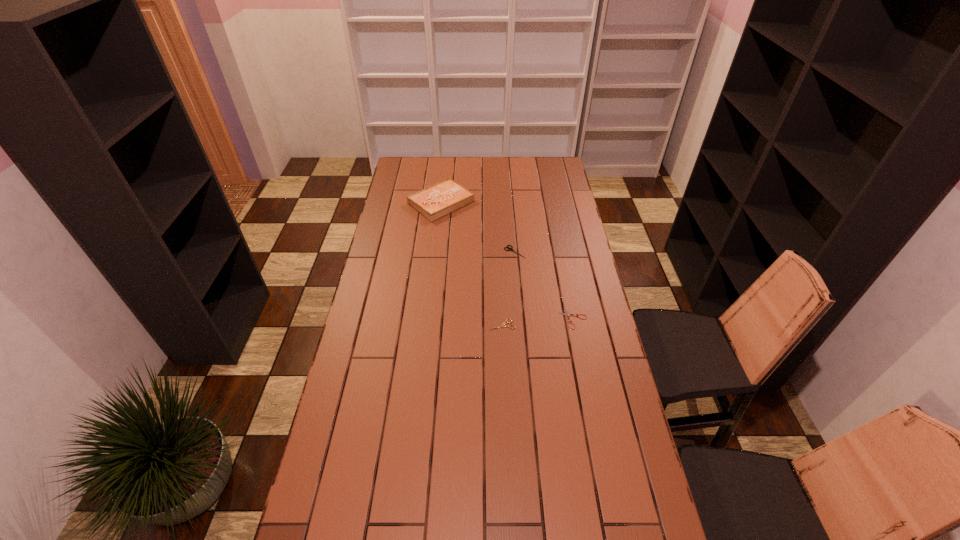
Find the location of `empty space that is in between the second shortest shears and the rightmost shears`. empty space that is in between the second shortest shears and the rightmost shears is located at coordinates (538, 321).

The image size is (960, 540). Find the location of `empty location between the second tallest shears and the tallest object`. empty location between the second tallest shears and the tallest object is located at coordinates (471, 264).

You are a GUI agent. You are given a task and a screenshot of the screen. Output one action in this format:
    pyautogui.click(x=<x>, y=<y>)
    Task: Click on the vacant space that is in between the leftmost object and the second shortest object
    This screenshot has height=540, width=960.
    Given the screenshot: What is the action you would take?
    pyautogui.click(x=471, y=264)

Where is `vacant space that's between the third tallest object and the farthest shears`? The image size is (960, 540). vacant space that's between the third tallest object and the farthest shears is located at coordinates (509, 288).

This screenshot has height=540, width=960. Identify the location of vacant space that is in between the farthest shears and the rightmost shears. (544, 285).

This screenshot has width=960, height=540. What are the coordinates of `vacant space that's between the rightmost object and the second shortest object` in the screenshot? It's located at (538, 321).

Find the location of a particular element. Image resolution: width=960 pixels, height=540 pixels. vacant space that's between the shortest shears and the third tallest object is located at coordinates (538, 321).

At what (x,y) coordinates should I click in order to perform the action: click on free spot between the second tallest shears and the shortest object. Please return your answer as a coordinate pair (x, y). The image size is (960, 540). Looking at the image, I should click on (538, 321).

Identify which object is the second nearest to the farthest shears. Please provide its 2D coordinates. Your answer should be formatted as a tuple, i.e. [(x, y)], where the tuple contains the x and y coordinates of a point satisfying the conditions above.

[(567, 314)]

Locate which object ranks third in proximity to the second tallest object. Please provide its 2D coordinates. Your answer should be formatted as a tuple, i.e. [(x, y)], where the tuple contains the x and y coordinates of a point satisfying the conditions above.

[(504, 323)]